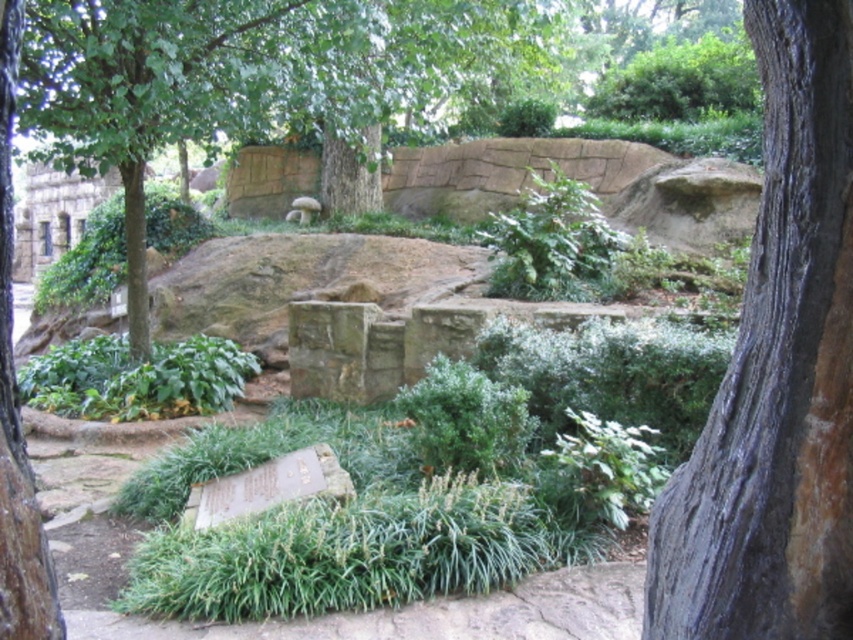
You are standing at the stone plaque in the garden and want to reach a point in the scene. Which of the two points, point (161, 109) or point (311, 198), is closer to you?

Point (161, 109) is closer to the viewer than point (311, 198).